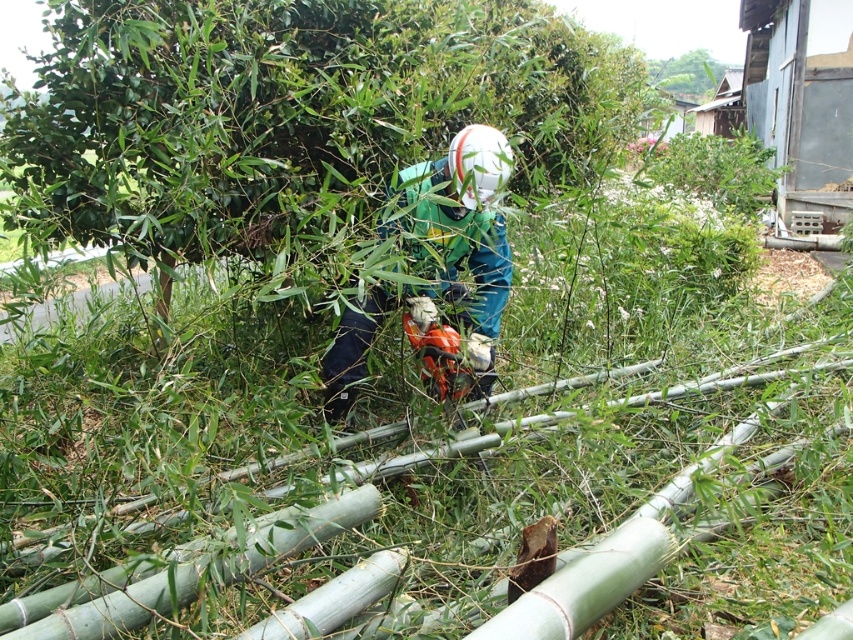
You are a drone operator tasked with delivering a tool to a worker in the scene. The worker is wearing a green matte jacket at center and is near green bamboo at upper center. The minimum safe distance for drone delivery is 50 feet. Can the drone safely deliver the tool to the worker?

The green matte jacket at center and green bamboo at upper center are 57.78 feet apart from each other. Since the minimum safe distance is 50 feet, the drone can safely deliver the tool to the worker as the distance between them is sufficient.

You are a drone operator trying to capture a closeup of the person cutting bamboo. The drone is currently at point 0.181, 0.341. The green bamboo at center is blocking the view. What should you do to get a clear shot of the person?

Move the drone away from the green bamboo at center located at point (289, 115) to avoid blocking the view.

You are a drone operator trying to locate the green matte jacket at center in an outdoor bamboo cutting scene. The scene has dense greenery and scattered bamboo stalks. Using coordinates, where would you direct the drone to find the jacket?

The green matte jacket at center is located at point (x=457, y=244), so direct the drone to that coordinate to find the jacket.